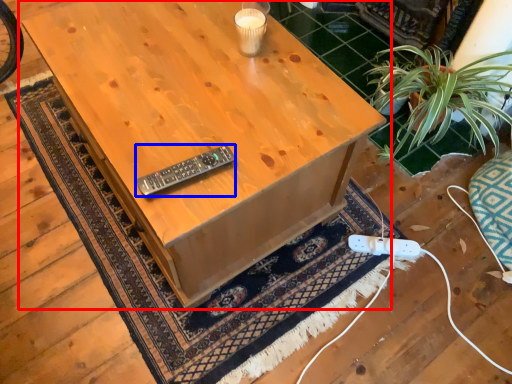
Question: Which of the following is the farthest to the observer, table (highlighted by a red box) or control (highlighted by a blue box)?

Choices:
 (A) table
 (B) control

Answer: (B)